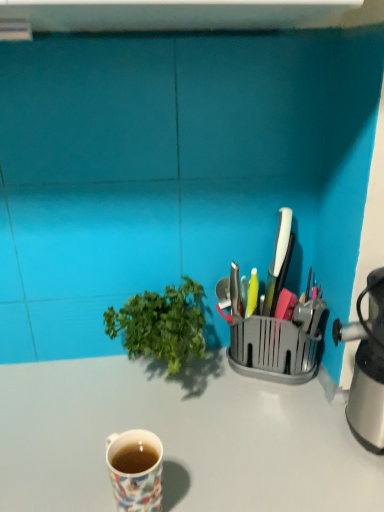
Find the location of `vacant area that lies between floral ceramic mug at lower left and metallic silver knife block at right`. vacant area that lies between floral ceramic mug at lower left and metallic silver knife block at right is located at coordinates (226, 426).